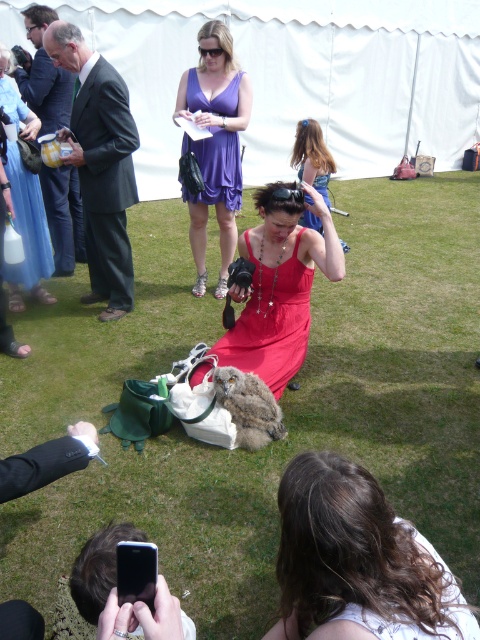
Which is in front, point (236, 180) or point (264, 412)?

Point (264, 412) is in front.

Measure the distance between purple satin dress at upper center and fuzzy brown owl at center.

6.54 feet

You are a GUI agent. You are given a task and a screenshot of the screen. Output one action in this format:
    pyautogui.click(x=<x>, y=<y>)
    Task: Click on the purple satin dress at upper center
    
    Given the screenshot: What is the action you would take?
    pos(216,168)

In order to click on purple satin dress at upper center in this screenshot , I will do `click(216, 168)`.

Which of these two, dark brown curly hair at lower center or matte purple dress at center, stands taller?

matte purple dress at center is taller.

Does point (430, 611) come farther from viewer compared to point (321, 129)?

No, (430, 611) is in front of (321, 129).

Does point (343, 516) lie behind point (320, 157)?

No, it is in front of (320, 157).

You are a GUI agent. You are given a task and a screenshot of the screen. Output one action in this format:
    pyautogui.click(x=<x>, y=<y>)
    Task: Click on the dark brown curly hair at lower center
    
    Given the screenshot: What is the action you would take?
    pyautogui.click(x=351, y=552)

Is green grass at center further to camera compared to red satin dress at center?

No, it is not.

Can you confirm if green grass at center is positioned below red satin dress at center?

Correct, green grass at center is located below red satin dress at center.

Locate an element on the screen. green grass at center is located at coordinates (305, 422).